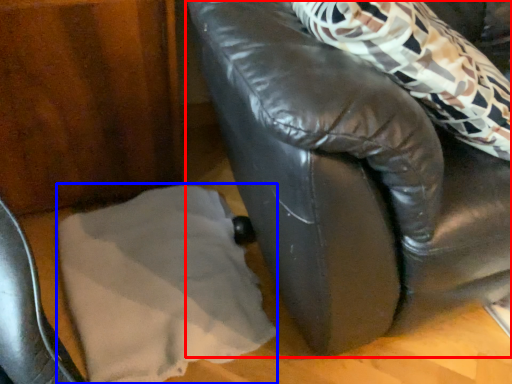
Question: Among these objects, which one is nearest to the camera, furniture (highlighted by a red box) or linen (highlighted by a blue box)?

Choices:
 (A) furniture
 (B) linen

Answer: (A)